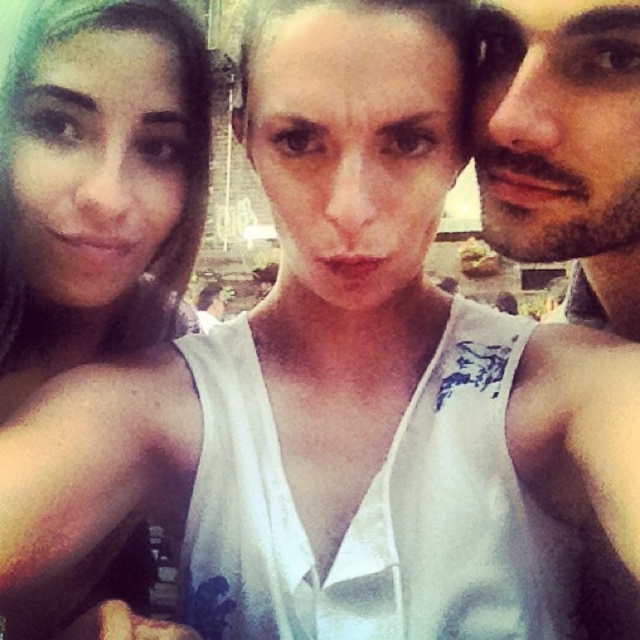
Question: Which of these objects is positioned closest to the matte skin face at left?

Choices:
 (A) white fabric tank top at upper left
 (B) white matte face at center
 (C) beardhairman at right
 (D) shiny white tank top at right

Answer: (A)

Question: Does white fabric tank top at upper left appear on the right side of matte skin face at left?

Choices:
 (A) yes
 (B) no

Answer: (B)

Question: Which of the following is the farthest from the observer?

Choices:
 (A) shiny white tank top at right
 (B) beardhairman at right
 (C) white fabric tank top at upper left

Answer: (B)

Question: Does shiny white tank top at right appear under beardhairman at right?

Choices:
 (A) yes
 (B) no

Answer: (A)

Question: Which point is farther to the camera?

Choices:
 (A) matte skin face at left
 (B) white matte face at center
 (C) shiny white tank top at right

Answer: (A)

Question: Considering the relative positions of white matte face at center and shiny white tank top at right in the image provided, where is white matte face at center located with respect to shiny white tank top at right?

Choices:
 (A) above
 (B) below

Answer: (A)